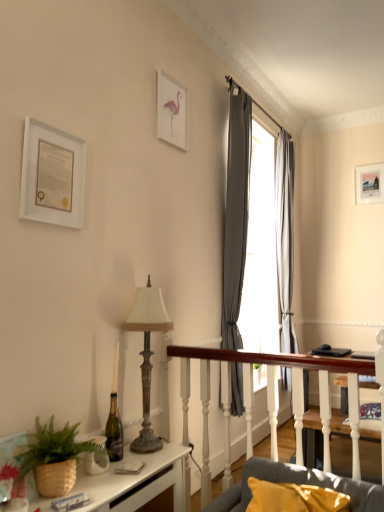
How much space does white matte picture frame at upper left, which is the third picture frame from back to front, occupy horizontally?

It is 5.49 centimeters.

What is the approximate height of white matte picture frame at upper left, which is the third picture frame from back to front?

white matte picture frame at upper left, which is the third picture frame from back to front, is 17.14 inches tall.

This screenshot has width=384, height=512. What do you see at coordinates (271, 398) in the screenshot?
I see `wooden table at center` at bounding box center [271, 398].

This screenshot has height=512, width=384. I want to click on brown woven basket at lower left, so click(55, 458).

At what (x,y) coordinates should I click in order to perform the action: click on antique brass lamp at center-left. Please return your answer as a coordinate pair (x, y). Looking at the image, I should click on (147, 354).

Is matte white picture frame at upper right, arranged as the first picture frame when viewed from the back, located within white matte picture frame at upper center, the second picture frame viewed from the left?

No, matte white picture frame at upper right, arranged as the first picture frame when viewed from the back, is not surrounded by white matte picture frame at upper center, the second picture frame viewed from the left.

Is white matte picture frame at upper center, acting as the 2th picture frame starting from the front, turned away from matte white picture frame at upper right, arranged as the first picture frame when viewed from the back?

No, white matte picture frame at upper center, acting as the 2th picture frame starting from the front,'s orientation is not away from matte white picture frame at upper right, arranged as the first picture frame when viewed from the back.

What are the coordinates of `picture frame located above the matte white picture frame at upper right, the first picture frame in the right-to-left sequence (from the image's perspective)` in the screenshot? It's located at (171, 111).

Considering the positions of objects white matte picture frame at upper center, acting as the 2th picture frame starting from the front, and matte white picture frame at upper right, the third picture frame when ordered from left to right, in the image provided, who is more to the left, white matte picture frame at upper center, acting as the 2th picture frame starting from the front, or matte white picture frame at upper right, the third picture frame when ordered from left to right,?

white matte picture frame at upper center, acting as the 2th picture frame starting from the front, is more to the left.

Are antique brass lamp at center-left and white matte picture frame at upper left, which is the third picture frame from back to front, far apart?

Absolutely, antique brass lamp at center-left is distant from white matte picture frame at upper left, which is the third picture frame from back to front.

Which object is thinner, antique brass lamp at center-left or white matte picture frame at upper left, the 1th picture frame positioned from the front?

white matte picture frame at upper left, the 1th picture frame positioned from the front.

From a real-world perspective, between antique brass lamp at center-left and white matte picture frame at upper left, which is counted as the 3th picture frame, starting from the right, who is vertically lower?

In real-world perspective, antique brass lamp at center-left is lower.

In the scene shown: Can you confirm if antique brass lamp at center-left is shorter than white matte picture frame at upper left, which is the third picture frame from back to front?

Incorrect, the height of antique brass lamp at center-left does not fall short of that of white matte picture frame at upper left, which is the third picture frame from back to front.

Which object is further away from the camera taking this photo, gray fabric curtain at upper right, the 1th curtain viewed from the right, or antique brass lamp at center-left?

gray fabric curtain at upper right, the 1th curtain viewed from the right, is further away from the camera.

How different are the orientations of gray fabric curtain at upper right, positioned as the second curtain in left-to-right order, and antique brass lamp at center-left in degrees?

They differ by 0.0123 degrees in their facing directions.

From a real-world perspective, is gray fabric curtain at upper right, placed as the 1th curtain when sorted from back to front, over antique brass lamp at center-left?

Yes, from a real-world perspective, gray fabric curtain at upper right, placed as the 1th curtain when sorted from back to front, is over antique brass lamp at center-left

From the image's perspective, between gray fabric curtain at upper right, the 1th curtain viewed from the right, and antique brass lamp at center-left, which one is located above?

gray fabric curtain at upper right, the 1th curtain viewed from the right, appears higher in the image.

Can you confirm if white matte picture frame at upper left, which is the third picture frame from back to front, is wider than matte white picture frame at upper right, placed as the 3th picture frame when sorted from front to back?

Yes, white matte picture frame at upper left, which is the third picture frame from back to front, is wider than matte white picture frame at upper right, placed as the 3th picture frame when sorted from front to back.

In the image, is white matte picture frame at upper left, which is the third picture frame from back to front, positioned in front of or behind matte white picture frame at upper right, placed as the 3th picture frame when sorted from front to back?

Clearly, white matte picture frame at upper left, which is the third picture frame from back to front, is in front of matte white picture frame at upper right, placed as the 3th picture frame when sorted from front to back.

Is white matte picture frame at upper left, arranged as the first picture frame when viewed from the left, facing towards matte white picture frame at upper right, arranged as the first picture frame when viewed from the back?

No, white matte picture frame at upper left, arranged as the first picture frame when viewed from the left, is not oriented towards matte white picture frame at upper right, arranged as the first picture frame when viewed from the back.

Between point (372, 499) and point (375, 198), which one is positioned behind?

Positioned behind is point (375, 198).

Can you confirm if gray fabric couch at lower right is bigger than matte white picture frame at upper right, the first picture frame in the right-to-left sequence?

Correct, gray fabric couch at lower right is larger in size than matte white picture frame at upper right, the first picture frame in the right-to-left sequence.

Which is more to the right, gray fabric couch at lower right or matte white picture frame at upper right, the third picture frame when ordered from left to right?

From the viewer's perspective, matte white picture frame at upper right, the third picture frame when ordered from left to right, appears more on the right side.

Is gray fabric couch at lower right inside the boundaries of matte white picture frame at upper right, arranged as the first picture frame when viewed from the back, or outside?

gray fabric couch at lower right is located beyond the bounds of matte white picture frame at upper right, arranged as the first picture frame when viewed from the back.

From the image's perspective, would you say matte white picture frame at upper right, placed as the 3th picture frame when sorted from front to back, is shown under white matte picture frame at upper center, positioned as the 2th picture frame in back-to-front order?

Indeed, from the image's perspective, matte white picture frame at upper right, placed as the 3th picture frame when sorted from front to back, is shown beneath white matte picture frame at upper center, positioned as the 2th picture frame in back-to-front order.

Is point (355, 195) closer to viewer compared to point (173, 89)?

No, it is not.

Does matte white picture frame at upper right, placed as the 3th picture frame when sorted from front to back, touch white matte picture frame at upper center, the second picture frame viewed from the left?

No, matte white picture frame at upper right, placed as the 3th picture frame when sorted from front to back, is not in contact with white matte picture frame at upper center, the second picture frame viewed from the left.

Is matte white picture frame at upper right, placed as the 3th picture frame when sorted from front to back, looking in the opposite direction of white matte picture frame at upper center, marked as the second picture frame in a right-to-left arrangement?

matte white picture frame at upper right, placed as the 3th picture frame when sorted from front to back, does not have its back to white matte picture frame at upper center, marked as the second picture frame in a right-to-left arrangement.

I want to click on houseplant to the left of white glossy desk at lower left, so click(55, 458).

Considering the sizes of objects white glossy desk at lower left and brown woven basket at lower left in the image provided, who is thinner, white glossy desk at lower left or brown woven basket at lower left?

With smaller width is white glossy desk at lower left.

Is white glossy desk at lower left to the right of brown woven basket at lower left from the viewer's perspective?

Indeed, white glossy desk at lower left is positioned on the right side of brown woven basket at lower left.

Looking at the image, does white glossy desk at lower left seem bigger or smaller compared to brown woven basket at lower left?

In the image, white glossy desk at lower left appears to be larger than brown woven basket at lower left.

This screenshot has width=384, height=512. What are the coordinates of `picture frame above the matte white picture frame at upper right, placed as the 3th picture frame when sorted from front to back (from the image's perspective)` in the screenshot? It's located at pyautogui.click(x=171, y=111).

Locate an element on the screen. the 1st picture frame positioned above the antique brass lamp at center-left (from a real-world perspective) is located at coordinates (52, 175).

Considering their positions, is wooden table at center positioned further to gray fabric curtain at upper right, positioned as the second curtain in left-to-right order, than white glossy desk at lower left?

The object further to gray fabric curtain at upper right, positioned as the second curtain in left-to-right order, is white glossy desk at lower left.

Looking at the image, which one is located further to wooden table at center, white matte picture frame at upper left, which is counted as the 3th picture frame, starting from the right, or brown woven basket at lower left?

white matte picture frame at upper left, which is counted as the 3th picture frame, starting from the right, is further to wooden table at center.

Estimate the real-world distances between objects in this image. Which object is closer to gray fabric couch at lower right, wooden table at center or gray fabric curtain at upper right, the 1th curtain in the front-to-back sequence?

wooden table at center lies closer to gray fabric couch at lower right than the other object.

Estimate the real-world distances between objects in this image. Which object is closer to white matte picture frame at upper left, which is the third picture frame from back to front, white matte picture frame at upper center, positioned as the 2th picture frame in back-to-front order, or brown woven basket at lower left?

white matte picture frame at upper center, positioned as the 2th picture frame in back-to-front order, lies closer to white matte picture frame at upper left, which is the third picture frame from back to front, than the other object.

In the scene shown: From the image, which object appears to be nearer to gray fabric couch at lower right, antique brass lamp at center-left or gray fabric curtain at upper right, placed as the 1th curtain when sorted from back to front?

antique brass lamp at center-left is positioned closer to the anchor gray fabric couch at lower right.

When comparing their distances from brown woven basket at lower left, does wooden table at center or antique brass lamp at center-left seem further?

Based on the image, wooden table at center appears to be further to brown woven basket at lower left.

Based on their spatial positions, is wooden table at center or antique brass lamp at center-left closer to matte white picture frame at upper right, placed as the 3th picture frame when sorted from front to back?

Among the two, wooden table at center is located nearer to matte white picture frame at upper right, placed as the 3th picture frame when sorted from front to back.

Which object lies further to the anchor point antique brass lamp at center-left, white matte picture frame at upper center, the second picture frame viewed from the left, or white matte picture frame at upper left, which is the third picture frame from back to front?

Based on the image, white matte picture frame at upper center, the second picture frame viewed from the left, appears to be further to antique brass lamp at center-left.

Identify the location of houseplant that lies between white matte picture frame at upper center, positioned as the 2th picture frame in back-to-front order, and gray fabric couch at lower right from top to bottom. The image size is (384, 512). coord(55,458).

Locate an element on the screen. The image size is (384, 512). lamp that lies between white matte picture frame at upper left, the 1th picture frame positioned from the front, and wooden table at center from top to bottom is located at coordinates (147, 354).

The width and height of the screenshot is (384, 512). Identify the location of studio couch located between white glossy desk at lower left and gray fabric curtain at upper right, the 1th curtain viewed from the right, in the depth direction. (297, 483).

This screenshot has width=384, height=512. In order to click on table located between gray fabric couch at lower right and gray fabric curtain at upper right, the first curtain positioned from the left, in the depth direction in this screenshot , I will do `click(271, 398)`.